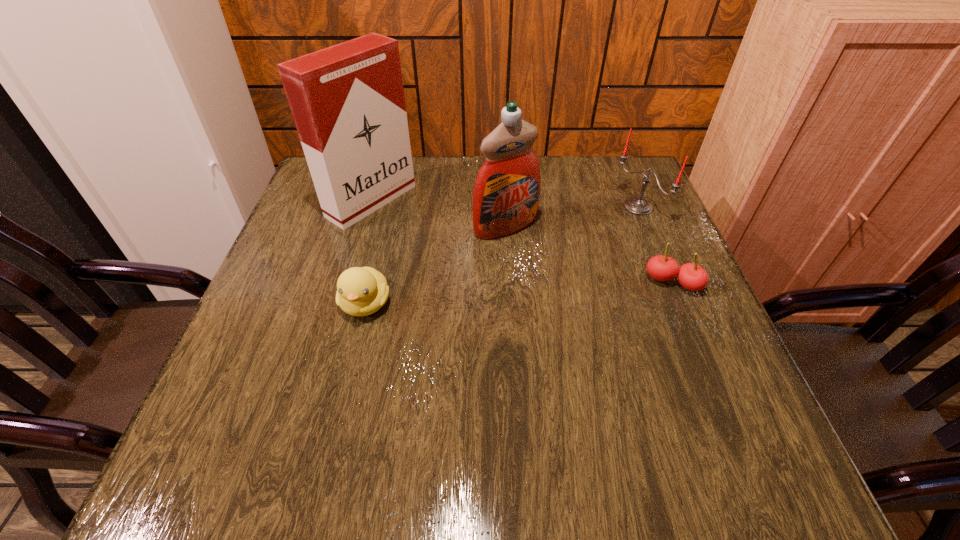
Image resolution: width=960 pixels, height=540 pixels. I want to click on vacant space that is in between the detergent and the duckling, so click(x=436, y=265).

Where is `vacant space that is in between the third shortest object and the cherry`? The height and width of the screenshot is (540, 960). vacant space that is in between the third shortest object and the cherry is located at coordinates (655, 245).

At what (x,y) coordinates should I click in order to perform the action: click on free space between the tallest object and the cherry. Please return your answer as a coordinate pair (x, y). This screenshot has height=540, width=960. Looking at the image, I should click on (522, 242).

Identify the location of vacant area between the second tallest object and the duckling. (436, 265).

Find the location of a particular element. free spot between the detergent and the candle is located at coordinates 572,217.

Locate an element on the screen. This screenshot has height=540, width=960. vacant space that is in between the cherry and the duckling is located at coordinates (519, 293).

Locate an element on the screen. free area in between the detergent and the candle is located at coordinates (572, 217).

Locate an element on the screen. object that stands as the second closest to the candle is located at coordinates (506, 194).

Identify which object is located as the nearest to the tallest object. Please provide its 2D coordinates. Your answer should be formatted as a tuple, i.e. [(x, y)], where the tuple contains the x and y coordinates of a point satisfying the conditions above.

[(506, 194)]

Locate an element on the screen. free region that satisfies the following two spatial constraints: 1. on the back side of the second tallest object; 2. on the left side of the third tallest object is located at coordinates (504, 207).